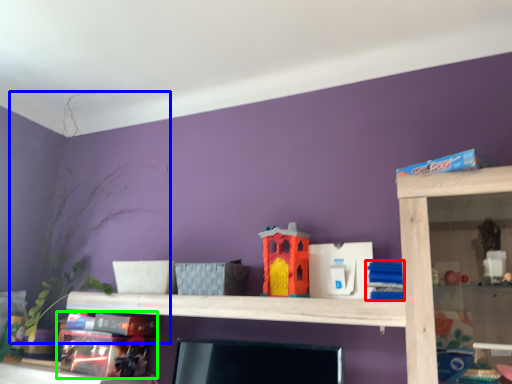
Question: Considering the real-world distances, which object is farthest from toy (highlighted by a red box)? plant (highlighted by a blue box) or toy (highlighted by a green box)?

Choices:
 (A) plant
 (B) toy

Answer: (A)